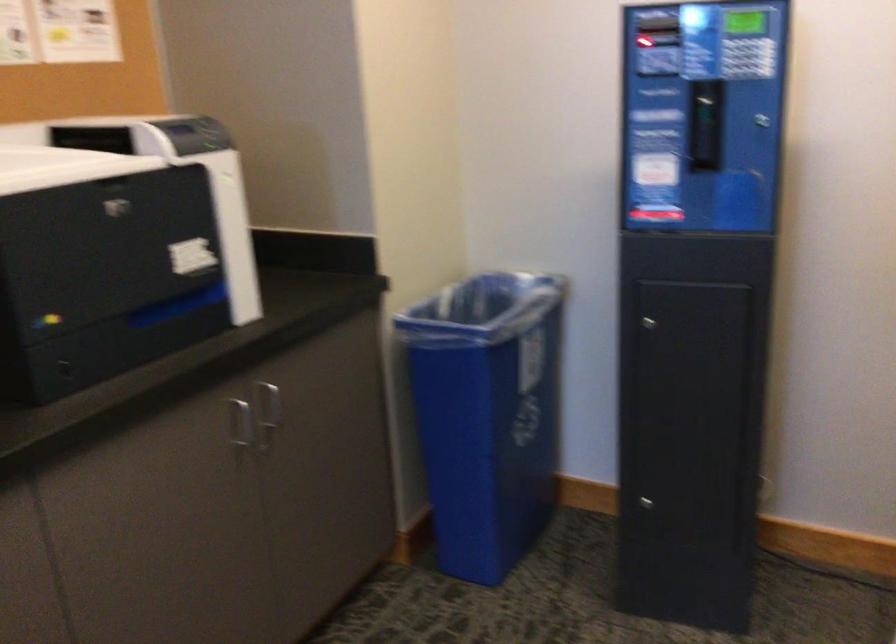
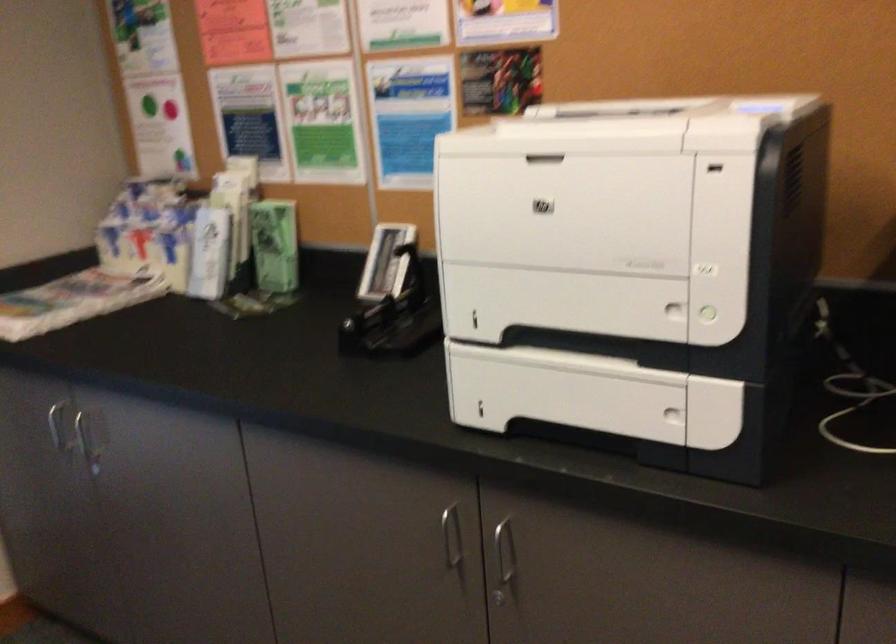
The first image is from the beginning of the video and the second image is from the end. How did the camera likely rotate when shooting the video?

The rotation direction of the camera is left-down.